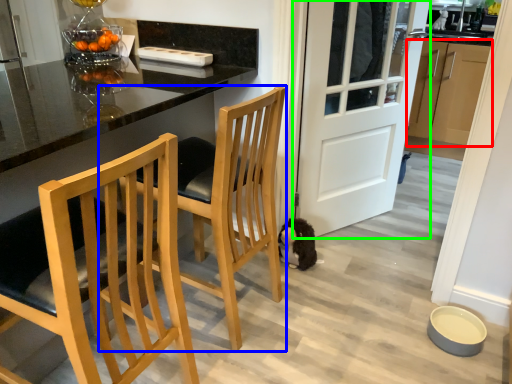
Question: Which object is positioned closest to cabinetry (highlighted by a red box)? Select from chair (highlighted by a blue box) and door (highlighted by a green box).

Choices:
 (A) chair
 (B) door

Answer: (B)